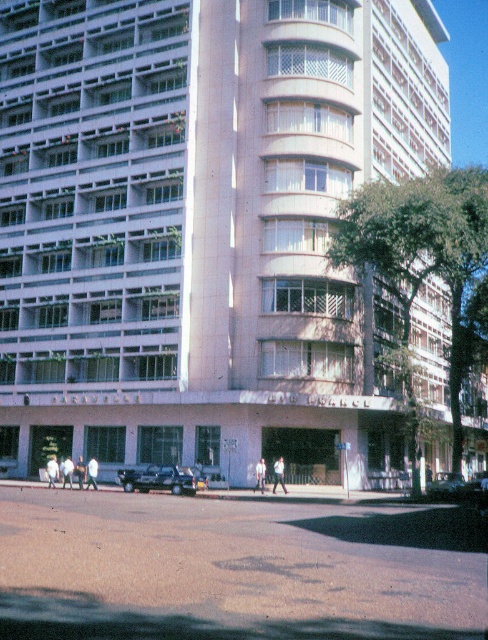
You are standing in front of the building and notice both the shiny silver sedan at center and the light brown leather jacket at center. Which object is nearer to you?

The shiny silver sedan at center is closer to the viewer than the light brown leather jacket at center.

You are standing in front of the building and want to park your car. There is a shiny silver sedan at center located at point (x=446, y=484). Is there enough space to park your car next to the shiny silver sedan at center?

The shiny silver sedan at center is located at point (x=446, y=484). Since the lower section of the building has a more open layout with large glass windows and doors suggesting a commercial or public space, there may be parking areas available. However, without specific information about parking spots or space dimensions, it is uncertain if there is enough space to park next to the shiny silver sedan at center.

You are a delivery driver approaching the building and need to park your vehicle. The parking lot has two spaces available at the center. Which vehicle, the metallic silver truck at center or the shiny silver sedan at center, is parked higher up in the parking area?

The metallic silver truck at center is parked higher up in the parking area because it is positioned above the shiny silver sedan at center.